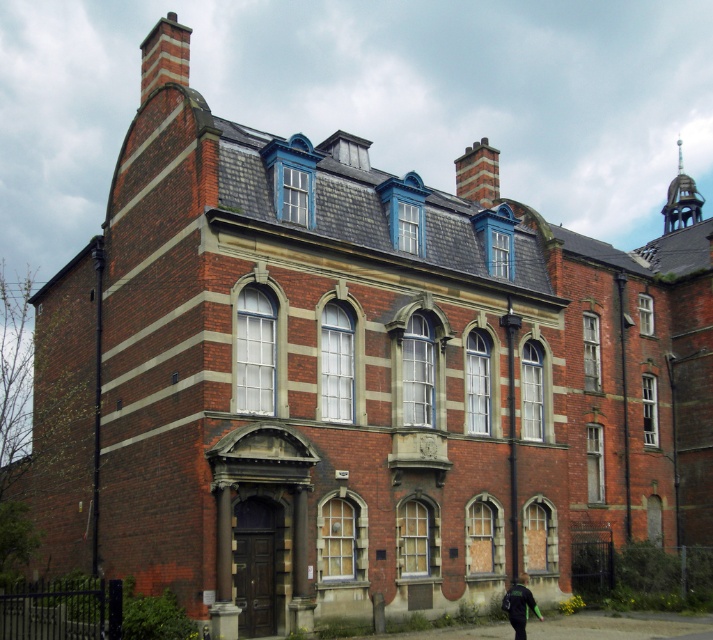
Question: Which point is farther from the camera taking this photo?

Choices:
 (A) (168, 19)
 (B) (468, 195)
 (C) (502, 608)

Answer: (B)

Question: Does brick chimney at upper center have a lesser width compared to green fabric jacket at lower center?

Choices:
 (A) yes
 (B) no

Answer: (B)

Question: Does brick chimney at upper left come behind brick chimney at upper center?

Choices:
 (A) yes
 (B) no

Answer: (B)

Question: Is brick chimney at upper left thinner than brick chimney at upper center?

Choices:
 (A) no
 (B) yes

Answer: (A)

Question: Which of the following is the farthest from the observer?

Choices:
 (A) brick chimney at upper left
 (B) green fabric jacket at lower center
 (C) brick chimney at upper center

Answer: (C)

Question: Which object appears farthest from the camera in this image?

Choices:
 (A) brick chimney at upper left
 (B) brick chimney at upper center
 (C) green fabric jacket at lower center

Answer: (B)